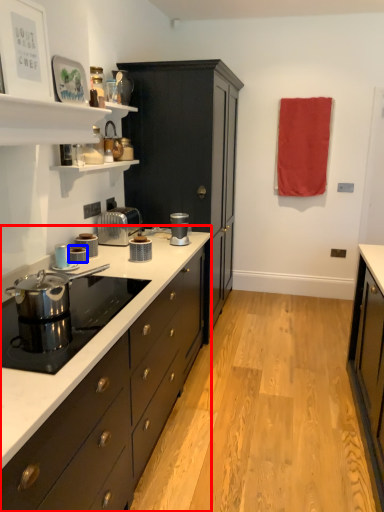
Question: Which object is closer to the camera taking this photo, countertop (highlighted by a red box) or kitchen appliance (highlighted by a blue box)?

Choices:
 (A) countertop
 (B) kitchen appliance

Answer: (A)